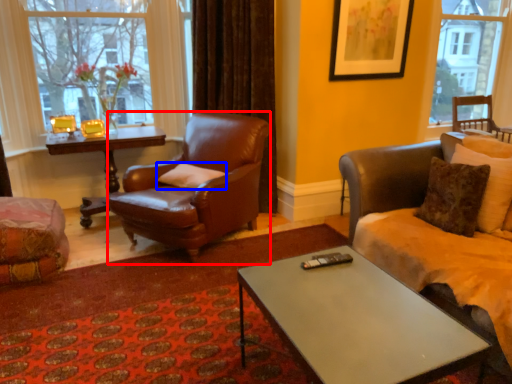
Question: Among these objects, which one is nearest to the camera, chair (highlighted by a red box) or pillow (highlighted by a blue box)?

Choices:
 (A) chair
 (B) pillow

Answer: (A)